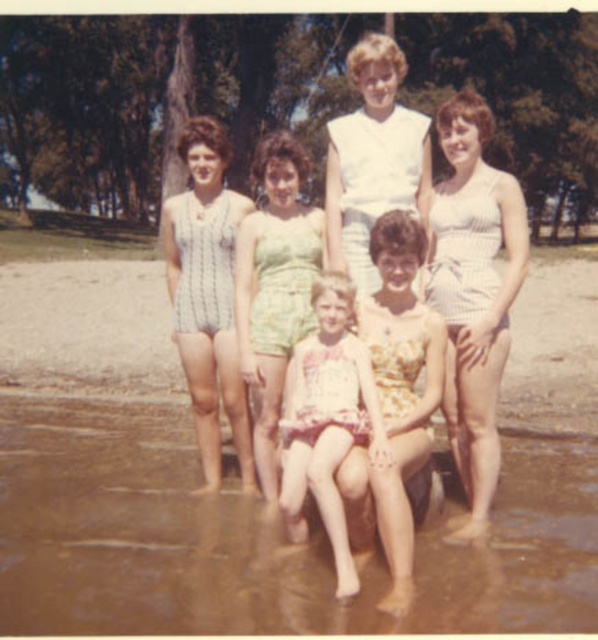
Question: Which point appears closest to the camera in this image?

Choices:
 (A) (209, 157)
 (B) (361, 372)
 (C) (404, 406)
 (D) (507, 240)

Answer: (B)

Question: Which point is closer to the camera?

Choices:
 (A) (309, 552)
 (B) (327, 456)

Answer: (B)

Question: Is green floral swimsuit at center below printed cotton dress at center?

Choices:
 (A) no
 (B) yes

Answer: (A)

Question: Is white textured swimsuit at lower right wider than printed cotton dress at center?

Choices:
 (A) no
 (B) yes

Answer: (A)

Question: Among these objects, which one is nearest to the camera?

Choices:
 (A) yellow floral dress at center
 (B) striped fabric swimsuit at left

Answer: (A)

Question: Is green floral swimsuit at center above printed cotton dress at center?

Choices:
 (A) no
 (B) yes

Answer: (B)